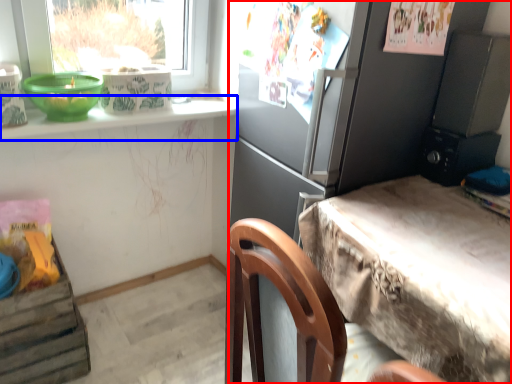
Question: Which of the following is the farthest to the observer, cabinetry (highlighted by a red box) or window sill (highlighted by a blue box)?

Choices:
 (A) cabinetry
 (B) window sill

Answer: (B)